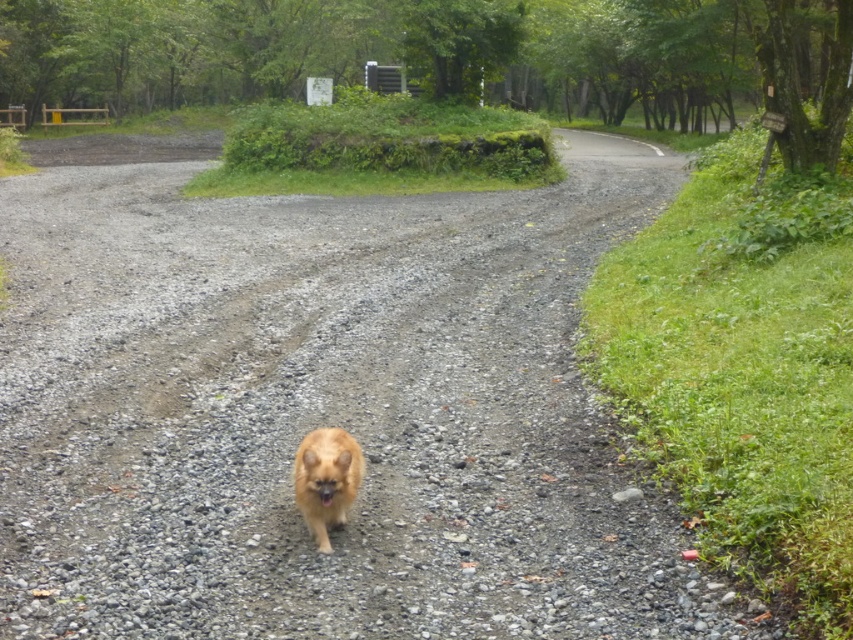
Who is lower down, gray gravel at center or golden fur dog at center?

golden fur dog at center is lower down.

Does gray gravel at center appear on the right side of golden fur dog at center?

Incorrect, gray gravel at center is not on the right side of golden fur dog at center.

Between point (251, 500) and point (294, 458), which one is positioned behind?

The point (294, 458) is more distant.

Identify the location of gray gravel at center. (323, 412).